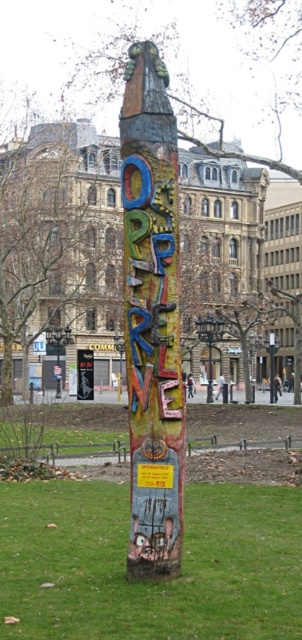
You are standing in the park and want to take a photo of the multicolored painted totem pole at center. To ensure the entire pole fits in the frame, you need to know if the green grass at center is wider than the pole. Can you confirm this?

The green grass at center is wider than the multicolored painted totem pole at center, so yes, the grass is wider than the pole.

You are standing in the public park and see the multicolored painted totem pole at center and the green grass at center. Which object is located higher up?

The multicolored painted totem pole at center is higher up than the green grass at center.